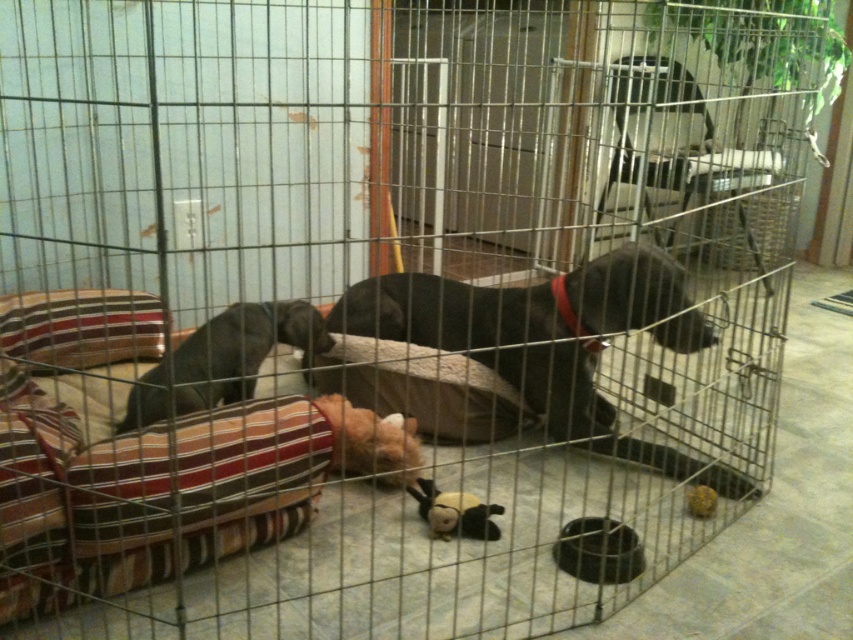
You are a delivery person who needs to place a small package inside the metal dog crate without disturbing the dogs. The package must be placed between the black smooth dog at center and the dark gray fur at left. Is there enough space between them for the package?

The black smooth dog at center is to the right of dark gray fur at left, so there is space between them to place the package.

You are a delivery person approaching the metal dog crate. You need to place a package between the black smooth dog at center and the dark gray fur at left. Which dog should you place the package closer to in order to reach the one that is closer to you?

The black smooth dog at center is closer to you, so place the package closer to the black smooth dog at center to reach it.